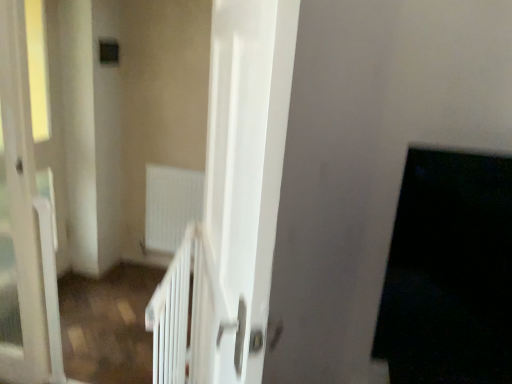
Question: From the image's perspective, relative to white matte radiator at center, is transparent glass screen door at left, placed as the 2th screen door when sorted from right to left, above or below?

Choices:
 (A) below
 (B) above

Answer: (B)

Question: From a real-world perspective, is transparent glass screen door at left, which is the 1th screen door in left-to-right order, above or below white matte radiator at center?

Choices:
 (A) above
 (B) below

Answer: (A)

Question: Considering the real-world distances, which object is farthest from the transparent glass screen door at left, placed as the 2th screen door when sorted from right to left?

Choices:
 (A) black matte door at right
 (B) white matte radiator at center
 (C) white glossy door at center, which is the first screen door in right-to-left order

Answer: (A)

Question: Considering the real-world distances, which object is closest to the white matte radiator at center?

Choices:
 (A) transparent glass screen door at left, placed as the 2th screen door when sorted from right to left
 (B) black matte door at right
 (C) white glossy door at center, the 2th screen door from the left

Answer: (A)